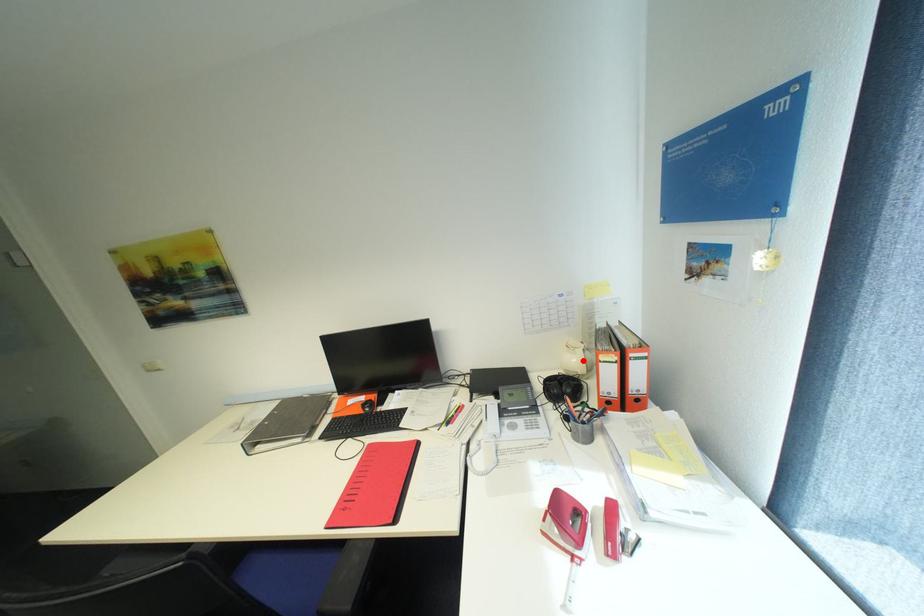
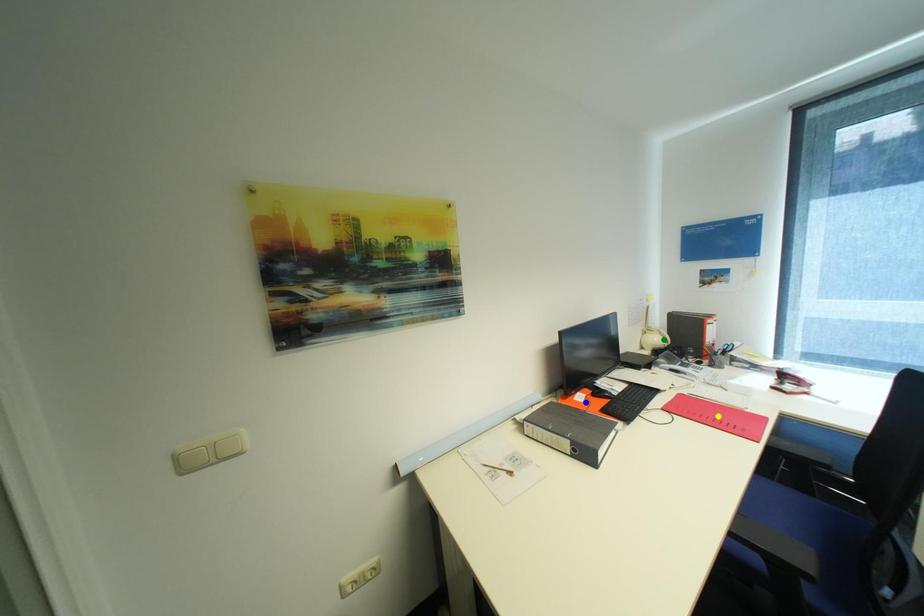
Question: I am providing you with two images of the same scene from different viewpoints. A red point is marked on the first image. You are given multiple points on the second image. Can you choose the point in image 2 that corresponds to the point in image 1?

Choices:
 (A) yellow point
 (B) blue point
 (C) green point

Answer: (C)